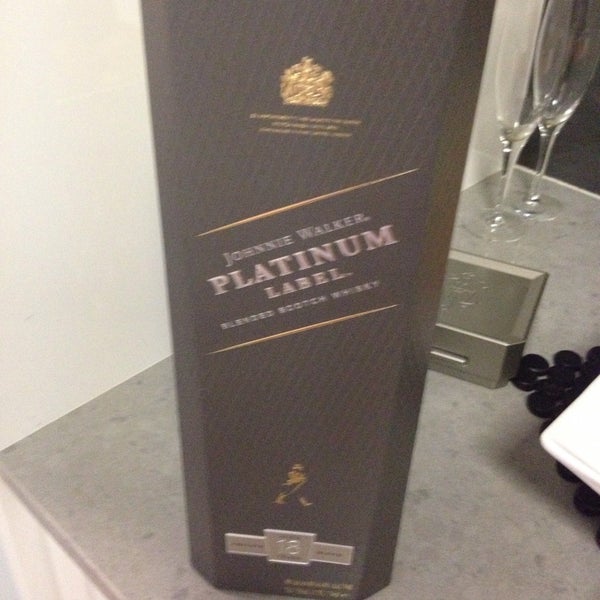
The image size is (600, 600). I want to click on white wall, so click(31, 359), click(150, 363), click(23, 26), click(478, 180), click(489, 84).